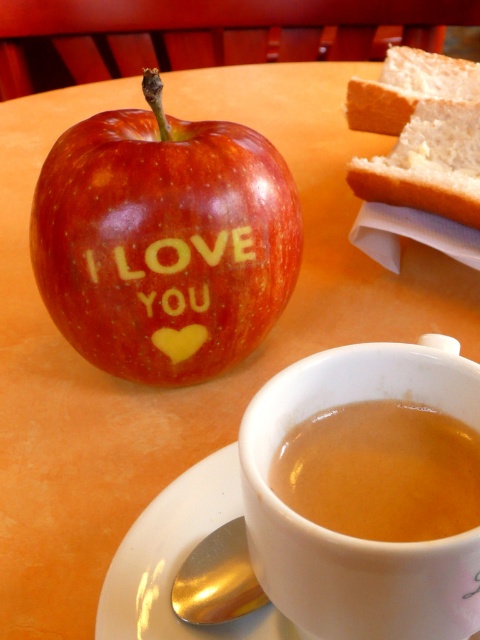
You are at a table and want to grab the gold reflective spoon at lower left. Is it under or next to the brown matte coffee cup at lower center?

The brown matte coffee cup at lower center is above the gold reflective spoon at lower left, so the spoon is under the cup.

You are setting up a table for a tea party. You have a gold reflective spoon at lower left and a gold embossed text at center. Which object is shorter in height?

The gold reflective spoon at lower left is shorter than the gold embossed text at center.

Based on the photo, you are setting up a table for a guest and need to place a teapot between the brown matte coffee cup at lower center and the gold reflective spoon at lower left. Based on their positions, where should the teapot be placed?

The brown matte coffee cup at lower center is to the right of the gold reflective spoon at lower left, so the teapot should be placed between them, closer to the gold reflective spoon at lower left since it is on the left side.